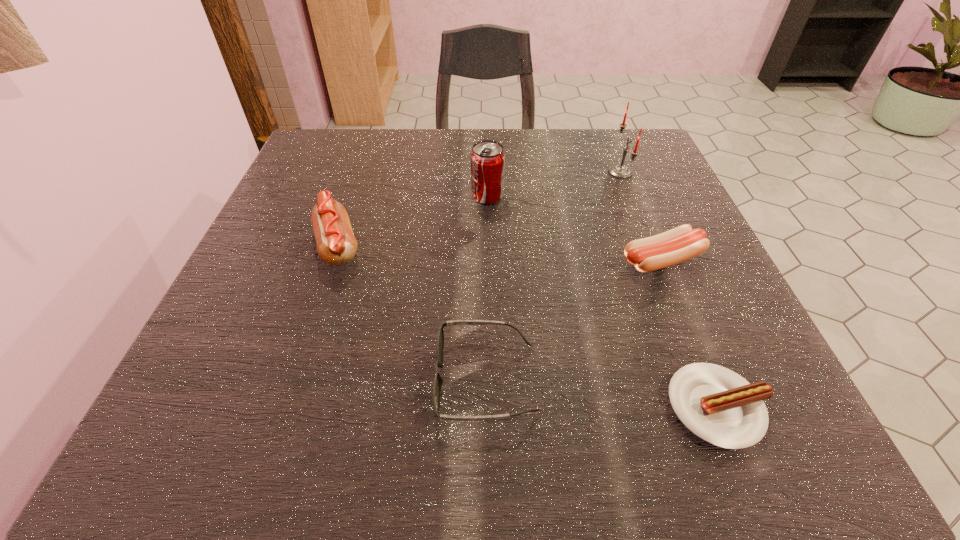
You are a GUI agent. You are given a task and a screenshot of the screen. Output one action in this format:
    pyautogui.click(x=<x>, y=<y>)
    Task: Click on the vacant space at the far right corner
    This screenshot has height=540, width=960.
    Given the screenshot: What is the action you would take?
    pyautogui.click(x=632, y=143)

The image size is (960, 540). I want to click on free space between the pop soda and the nearest sausage, so click(x=603, y=302).

I want to click on free space between the leftmost sausage and the sunglasses, so click(x=412, y=312).

Identify the location of free spot between the shortest object and the tallest object. (669, 289).

I want to click on vacant area that lies between the shortest object and the candle, so click(x=669, y=289).

Where is `free space between the candle and the pop soda`? The width and height of the screenshot is (960, 540). free space between the candle and the pop soda is located at coordinates (554, 184).

Locate an element on the screen. Image resolution: width=960 pixels, height=540 pixels. blank region between the second shortest sausage and the candle is located at coordinates (641, 216).

Locate an element on the screen. Image resolution: width=960 pixels, height=540 pixels. empty space between the fourth tallest object and the tallest object is located at coordinates (641, 216).

Locate an element on the screen. The width and height of the screenshot is (960, 540). blank region between the second tallest sausage and the leftmost object is located at coordinates (500, 253).

This screenshot has width=960, height=540. Identify the location of free space between the pop soda and the second tallest sausage. coord(575,228).